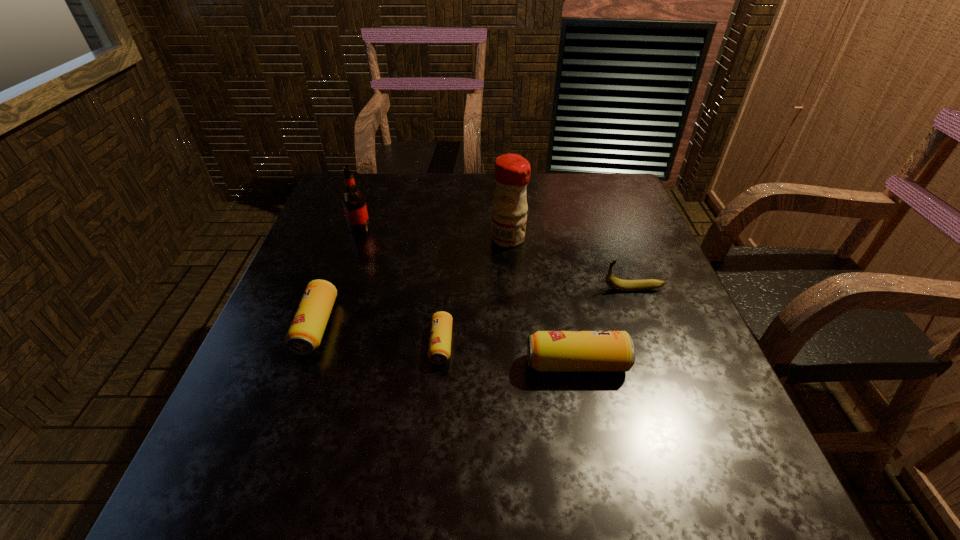
In order to click on free space located on the back of the rightmost beer can in this screenshot , I will do `click(567, 319)`.

Identify the location of free location located 0.230m on the right of the root beer. (455, 228).

Locate an element on the screen. Image resolution: width=960 pixels, height=540 pixels. vacant space located 0.250m at the stem of the banana is located at coordinates (494, 288).

Find the location of a particular element. The width and height of the screenshot is (960, 540). vacant region located at the stem of the banana is located at coordinates click(x=560, y=288).

Locate an element on the screen. Image resolution: width=960 pixels, height=540 pixels. vacant region located 0.320m at the stem of the banana is located at coordinates (465, 288).

Where is `free space located 0.390m on the left of the condiment`? The width and height of the screenshot is (960, 540). free space located 0.390m on the left of the condiment is located at coordinates (344, 239).

Identify the location of beer can located at the left edge. The image size is (960, 540). (305, 333).

Find the location of a particular element. This screenshot has height=540, width=960. root beer located at the left edge is located at coordinates (354, 204).

What are the coordinates of `object at the right edge` in the screenshot? It's located at (624, 285).

In order to click on vacant space at the far edge in this screenshot , I will do `click(576, 203)`.